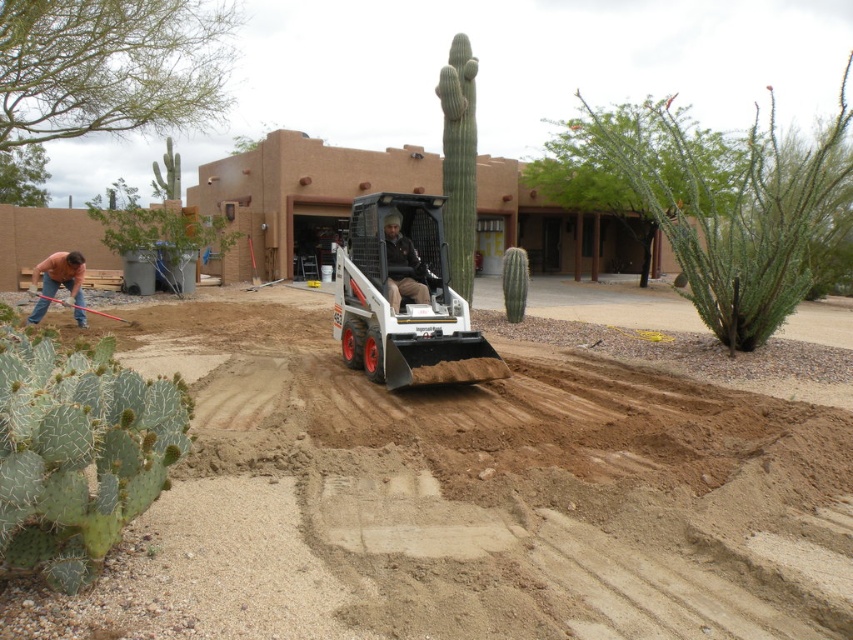
Question: Is brown gravel at center bigger than dark brown leather jacket at center?

Choices:
 (A) yes
 (B) no

Answer: (A)

Question: Which object appears closest to the camera in this image?

Choices:
 (A) matte pink shirt at left
 (B) brown gravel at center

Answer: (B)

Question: Which point is closer to the camera?

Choices:
 (A) (387, 230)
 (B) (82, 269)
 (C) (361, 244)

Answer: (A)

Question: Among these points, which one is farthest from the camera?

Choices:
 (A) (346, 404)
 (B) (426, 269)
 (C) (440, 349)
 (D) (35, 314)

Answer: (D)

Question: Can you confirm if brown gravel at center is bigger than matte pink shirt at left?

Choices:
 (A) yes
 (B) no

Answer: (A)

Question: Does white rubber skid steer loader at center have a larger size compared to matte pink shirt at left?

Choices:
 (A) yes
 (B) no

Answer: (A)